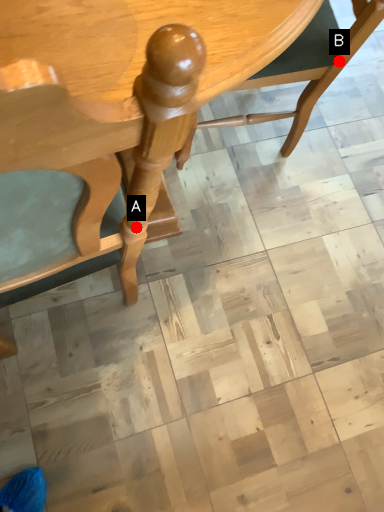
Question: Two points are circled on the image, labeled by A and B beside each circle. Which point appears farthest from the camera in this image?

Choices:
 (A) A is further
 (B) B is further

Answer: (B)